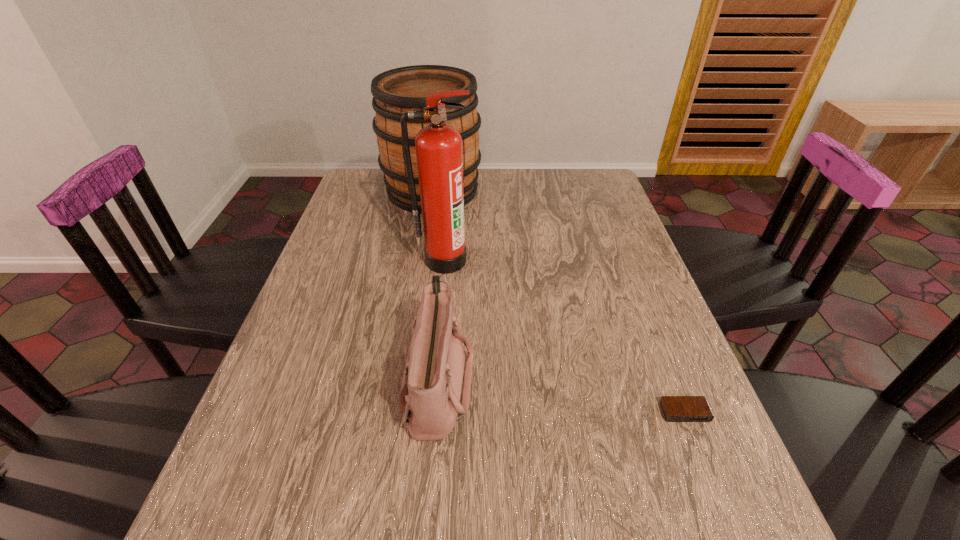
Image resolution: width=960 pixels, height=540 pixels. What are the coordinates of `free point between the tallest object and the alarm clock` in the screenshot? It's located at (564, 336).

This screenshot has height=540, width=960. In order to click on vacant space that's between the shoulder bag and the rightmost object in this screenshot , I will do `click(562, 396)`.

Locate an element on the screen. vacant point located between the shoulder bag and the alarm clock is located at coordinates (562, 396).

Where is `free space that is in between the alarm clock and the shoulder bag`? The height and width of the screenshot is (540, 960). free space that is in between the alarm clock and the shoulder bag is located at coordinates (562, 396).

Image resolution: width=960 pixels, height=540 pixels. Find the location of `unoccupied area between the third tallest object and the shortest object`. unoccupied area between the third tallest object and the shortest object is located at coordinates tap(562, 396).

At what (x,y) coordinates should I click in order to perform the action: click on the third closest object to the second shortest object. Please return your answer as a coordinate pair (x, y). Image resolution: width=960 pixels, height=540 pixels. Looking at the image, I should click on (397, 91).

Identify the location of object that stands as the third closest to the rightmost object. The width and height of the screenshot is (960, 540). (397, 91).